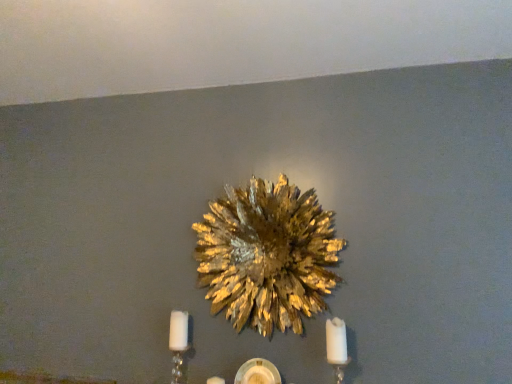
What do you see at coordinates (178, 343) in the screenshot? I see `white crystal candle holder at lower left` at bounding box center [178, 343].

I want to click on white matte candle at lower right, so click(336, 341).

You are a GUI agent. You are given a task and a screenshot of the screen. Output one action in this format:
    pyautogui.click(x=<x>, y=<y>)
    Task: Click on the gold metallic flower at center
    
    Given the screenshot: What is the action you would take?
    pyautogui.click(x=267, y=255)

This screenshot has width=512, height=384. What are the coordinates of `candle that appears below the white crystal candle holder at lower left (from a real-world perspective)` in the screenshot? It's located at (336, 341).

Is white crystal candle holder at lower left next to white matte candle at lower right?

white crystal candle holder at lower left is not next to white matte candle at lower right, and they're not touching.

From the picture: From a real-world perspective, is white crystal candle holder at lower left positioned over white matte candle at lower right based on gravity?

Yes, from a real-world perspective, white crystal candle holder at lower left is over white matte candle at lower right

Between white matte candle at lower right and white crystal candle holder at lower left, which one has more height?

white matte candle at lower right is taller.

Does point (346, 359) lie behind point (172, 367)?

That is False.

From the image's perspective, which one is positioned lower, white matte candle at lower right or white crystal candle holder at lower left?

From the image's view, white crystal candle holder at lower left is below.

Is white matte candle at lower right closer to camera compared to white crystal candle holder at lower left?

Yes, the depth of white matte candle at lower right is less than that of white crystal candle holder at lower left.

Which of these two, white crystal candle holder at lower left or gold metallic flower at center, stands shorter?

white crystal candle holder at lower left.

Can you tell me how much white crystal candle holder at lower left and gold metallic flower at center differ in facing direction?

The angular difference between white crystal candle holder at lower left and gold metallic flower at center is 5.77 degrees.

Does white crystal candle holder at lower left turn towards gold metallic flower at center?

No, white crystal candle holder at lower left is not aimed at gold metallic flower at center.

Does white crystal candle holder at lower left appear on the left side of gold metallic flower at center?

Yes.

Identify the location of candle holder below the gold metallic flower at center (from the image's perspective). The width and height of the screenshot is (512, 384). (178, 343).

Is gold metallic flower at center far away from white crystal candle holder at lower left?

No, gold metallic flower at center is in close proximity to white crystal candle holder at lower left.

Based on the photo, which of these two, gold metallic flower at center or white crystal candle holder at lower left, is smaller?

white crystal candle holder at lower left.

Which of these two, gold metallic flower at center or white crystal candle holder at lower left, is thinner?

white crystal candle holder at lower left is thinner.

Which of these two, white matte candle at lower right or gold metallic flower at center, is wider?

Wider between the two is white matte candle at lower right.

From a real-world perspective, which object rests below the other?

From a 3D spatial view, white matte candle at lower right is below.

Can you confirm if white matte candle at lower right is taller than gold metallic flower at center?

Incorrect, the height of white matte candle at lower right is not larger of that of gold metallic flower at center.

Looking at this image, does white matte candle at lower right lie behind gold metallic flower at center?

No.

In the image, is gold metallic flower at center on the left side or the right side of white matte candle at lower right?

Based on their positions, gold metallic flower at center is located to the left of white matte candle at lower right.

In the scene shown: From the image's perspective, is gold metallic flower at center positioned above or below white matte candle at lower right?

Based on their image positions, gold metallic flower at center is located above white matte candle at lower right.

Locate an element on the screen. flower above the white matte candle at lower right (from the image's perspective) is located at coordinates (267, 255).

Does point (209, 251) lie in front of point (340, 330)?

That is False.

You are a GUI agent. You are given a task and a screenshot of the screen. Output one action in this format:
    pyautogui.click(x=<x>, y=<y>)
    Task: Click on the candle holder behind the white matte candle at lower right
    
    Given the screenshot: What is the action you would take?
    pyautogui.click(x=178, y=343)

Image resolution: width=512 pixels, height=384 pixels. Identify the location of candle holder below the white matte candle at lower right (from the image's perspective). (178, 343).

When comparing their distances from white matte candle at lower right, does gold metallic flower at center or white crystal candle holder at lower left seem further?

white crystal candle holder at lower left lies further to white matte candle at lower right than the other object.

In the scene shown: Which object lies further to the anchor point white crystal candle holder at lower left, white matte candle at lower right or gold metallic flower at center?

white matte candle at lower right is further to white crystal candle holder at lower left.

When comparing their distances from white matte candle at lower right, does white crystal candle holder at lower left or gold metallic flower at center seem closer?

Based on the image, gold metallic flower at center appears to be nearer to white matte candle at lower right.

When comparing their distances from gold metallic flower at center, does white matte candle at lower right or white crystal candle holder at lower left seem further?

Based on the image, white crystal candle holder at lower left appears to be further to gold metallic flower at center.

Which object lies further to the anchor point gold metallic flower at center, white crystal candle holder at lower left or white matte candle at lower right?

white crystal candle holder at lower left lies further to gold metallic flower at center than the other object.

From the image, which object appears to be nearer to white crystal candle holder at lower left, gold metallic flower at center or white matte candle at lower right?

gold metallic flower at center is positioned closer to the anchor white crystal candle holder at lower left.

This screenshot has width=512, height=384. I want to click on flower between white crystal candle holder at lower left and white matte candle at lower right from left to right, so click(267, 255).